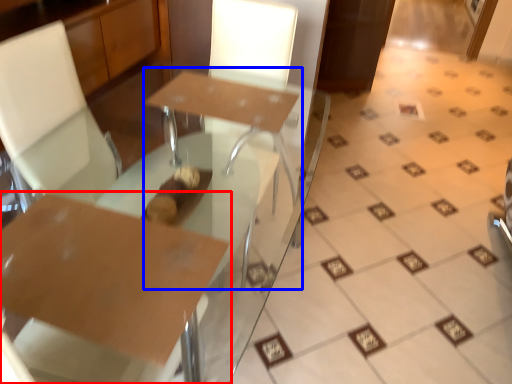
Question: Which object is further to the camera taking this photo, table (highlighted by a red box) or round table (highlighted by a blue box)?

Choices:
 (A) table
 (B) round table

Answer: (B)